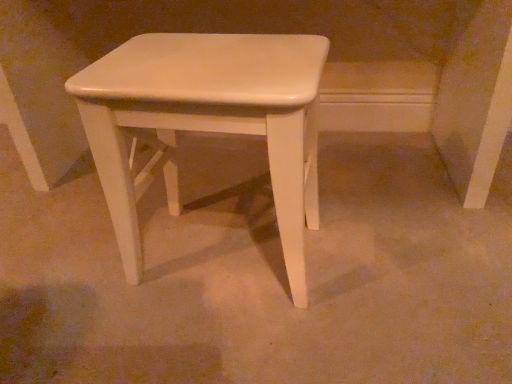
Where is `white glossy stool at center`? white glossy stool at center is located at coordinates (206, 122).

What do you see at coordinates (206, 122) in the screenshot?
I see `white glossy stool at center` at bounding box center [206, 122].

Find the location of `white glossy stool at center`. white glossy stool at center is located at coordinates (206, 122).